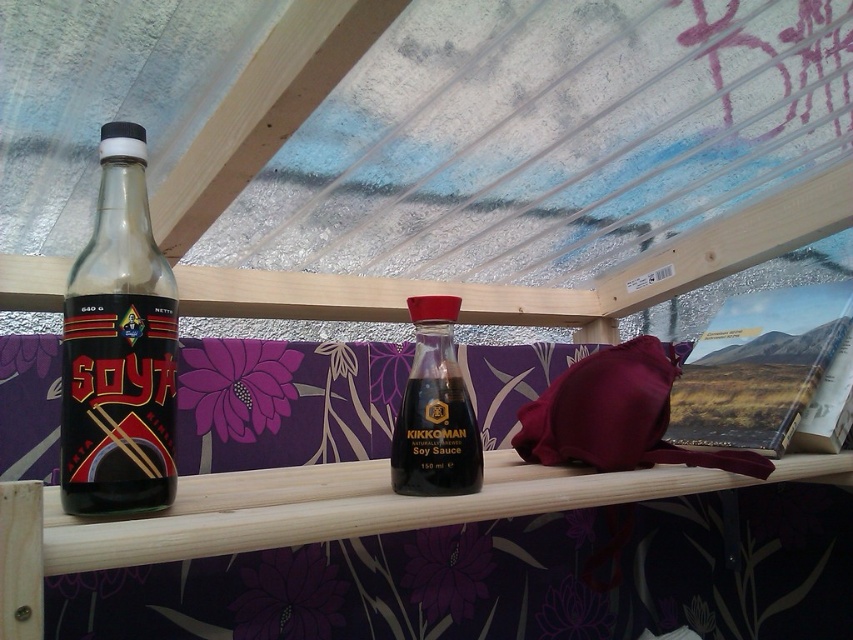
Between matte glass soy sauce bottle at left and dark brown glass bottle at center, which one has less height?

Standing shorter between the two is dark brown glass bottle at center.

Which is below, matte glass soy sauce bottle at left or dark brown glass bottle at center?

Positioned lower is dark brown glass bottle at center.

Which is behind, point (154, 376) or point (408, 396)?

Point (408, 396)

Where is `matte glass soy sauce bottle at left`? matte glass soy sauce bottle at left is located at coordinates (119, 348).